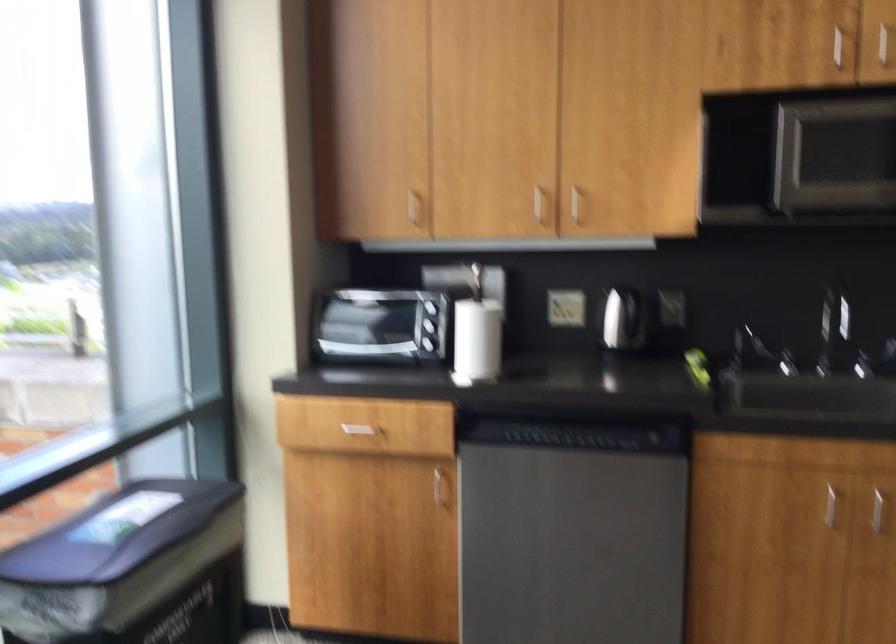
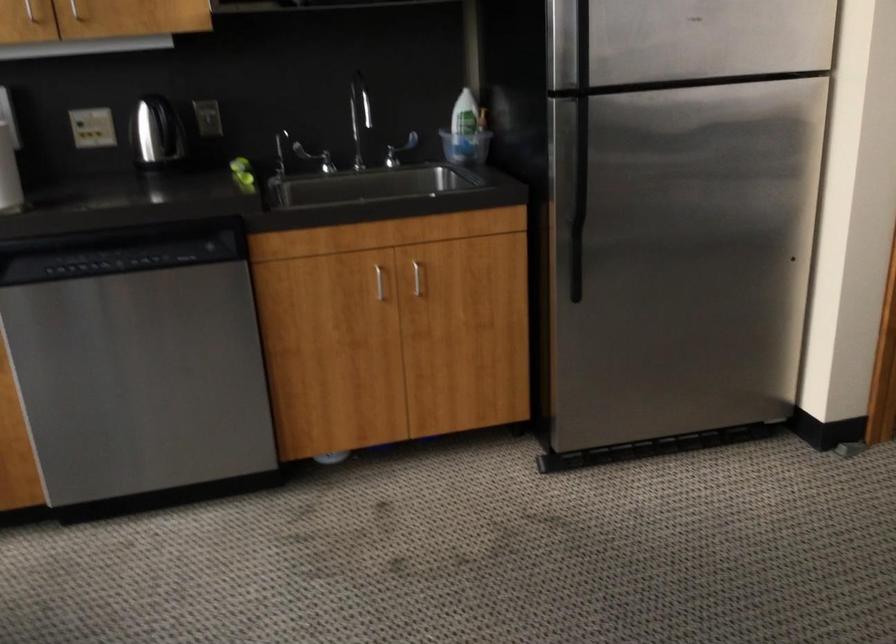
Question: How did the camera likely rotate?

Choices:
 (A) Left
 (B) Right
 (C) Up
 (D) Down

Answer: (B)